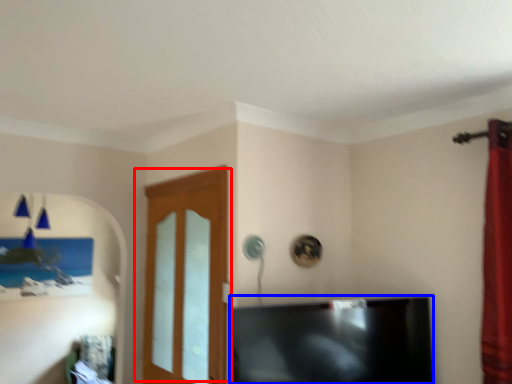
Question: Which point is further to the camera, door (highlighted by a red box) or television (highlighted by a blue box)?

Choices:
 (A) door
 (B) television

Answer: (A)